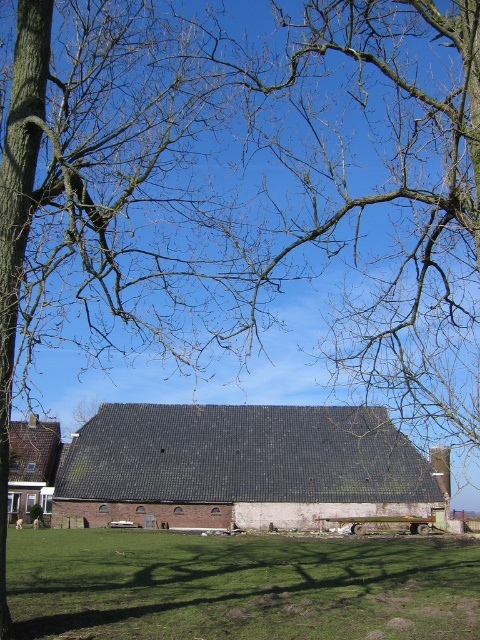
Question: Estimate the real-world distances between objects in this image. Which object is farther from the green grass at lower center?

Choices:
 (A) dark gray shingles at center
 (B) brown tiled barn at lower left

Answer: (A)

Question: Is green grass at lower center to the right of brown tiled barn at lower left from the viewer's perspective?

Choices:
 (A) yes
 (B) no

Answer: (A)

Question: Which point is closer to the camera?

Choices:
 (A) (235, 554)
 (B) (389, 492)

Answer: (A)

Question: Which object is farther from the camera taking this photo?

Choices:
 (A) green grass at lower center
 (B) brown tiled barn at lower left

Answer: (B)

Question: Does green grass at lower center appear on the right side of brown tiled barn at lower left?

Choices:
 (A) no
 (B) yes

Answer: (B)

Question: Is green grass at lower center bigger than brown tiled barn at lower left?

Choices:
 (A) no
 (B) yes

Answer: (A)